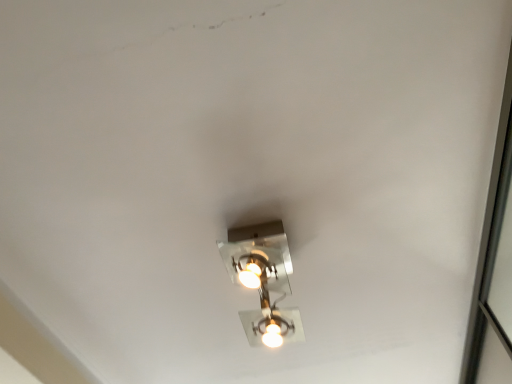
What do you see at coordinates (263, 279) in the screenshot? I see `metallic silver lamp at center` at bounding box center [263, 279].

Where is `metallic silver lamp at center`? metallic silver lamp at center is located at coordinates (263, 279).

This screenshot has width=512, height=384. I want to click on metallic silver lamp at center, so click(263, 279).